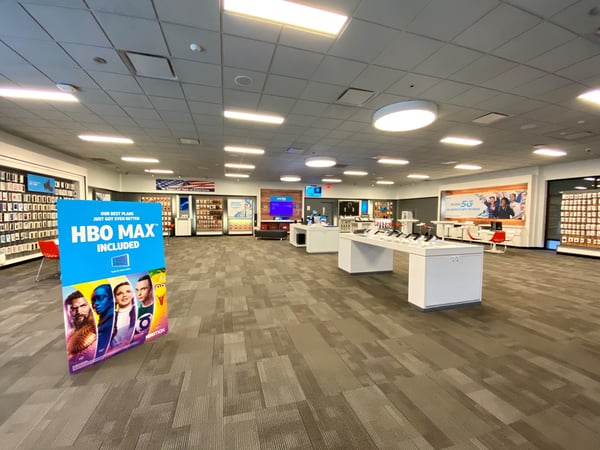
At what (x,y) coordinates should I click in order to perform the action: click on flooring. Please return your answer as a coordinate pair (x, y). Looking at the image, I should click on (250, 324).